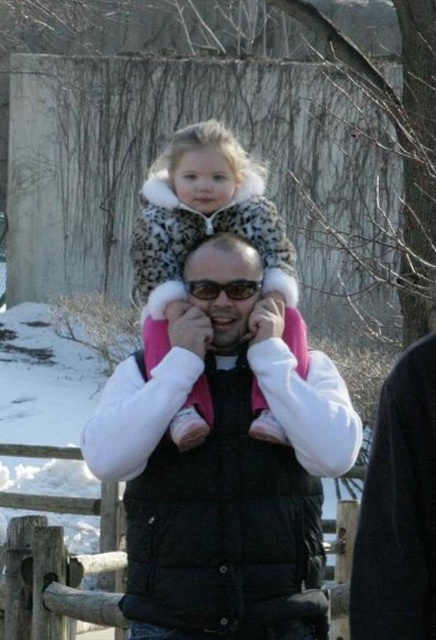
Who is lower down, black puffy vest at center or spotted fur coat at center?

black puffy vest at center is lower down.

Is point (197, 461) closer to viewer compared to point (221, 180)?

Yes.

Image resolution: width=436 pixels, height=640 pixels. I want to click on black puffy vest at center, so click(224, 468).